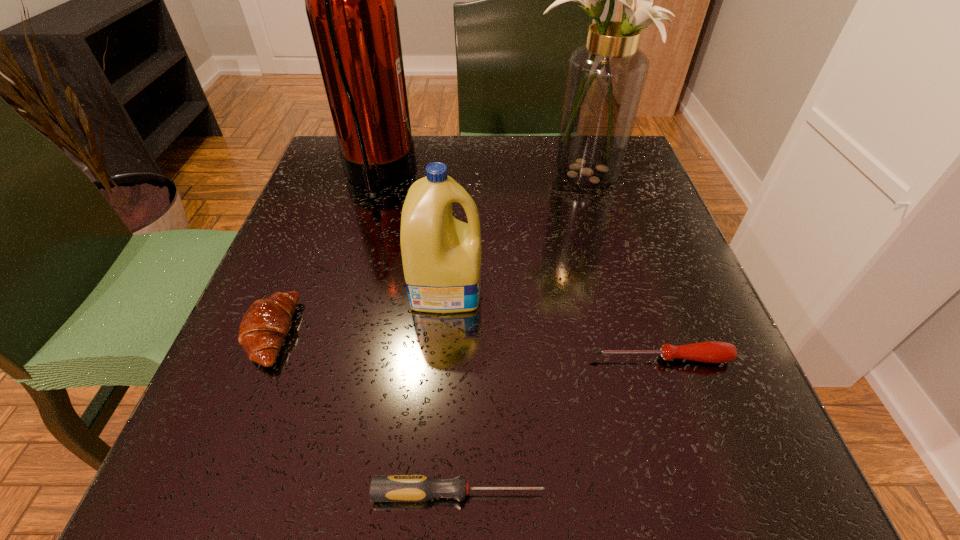
This screenshot has height=540, width=960. I want to click on the tallest object, so click(350, 0).

What are the coordinates of `flower arrangement` in the screenshot? It's located at (605, 79).

Find the location of a particular element. This screenshot has width=960, height=540. detergent is located at coordinates (441, 256).

Find the location of a particular element. The height and width of the screenshot is (540, 960). crescent roll is located at coordinates (266, 323).

You are a GUI agent. You are given a task and a screenshot of the screen. Output one action in this format:
    pyautogui.click(x=<x>, y=<y>)
    Task: Click on the farther screwdriver
    Image resolution: width=960 pixels, height=540 pixels.
    Given the screenshot: What is the action you would take?
    pyautogui.click(x=708, y=351)

At what (x,y) coordinates should I click in order to perform the action: click on the nearest object. Please return your answer as a coordinate pair (x, y). This screenshot has width=960, height=540. Looking at the image, I should click on (383, 488).

In order to click on the left screwdriver in this screenshot , I will do `click(383, 488)`.

At what (x,y) coordinates should I click in order to perform the action: click on vacant area located on the front-facing side of the fire extinguisher. Please return your answer as a coordinate pair (x, y). Looking at the image, I should click on (492, 177).

Find the location of `vacant space located on the front of the flower arrangement`. vacant space located on the front of the flower arrangement is located at coordinates (637, 374).

I want to click on vacant region located on the label of the detergent, so click(x=582, y=286).